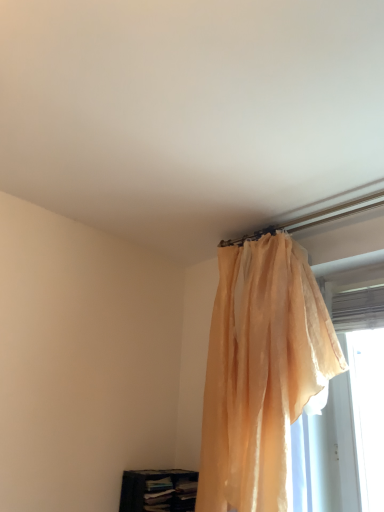
Question: From the image's perspective, is translucent peach curtain at upper right located beneath translucent fabric at right?

Choices:
 (A) yes
 (B) no

Answer: (A)

Question: Does translucent peach curtain at upper right come behind translucent fabric at right?

Choices:
 (A) yes
 (B) no

Answer: (B)

Question: From a real-world perspective, does translucent peach curtain at upper right stand above translucent fabric at right?

Choices:
 (A) no
 (B) yes

Answer: (A)

Question: Is translucent peach curtain at upper right facing away from translucent fabric at right?

Choices:
 (A) yes
 (B) no

Answer: (B)

Question: Is translucent peach curtain at upper right thinner than translucent fabric at right?

Choices:
 (A) yes
 (B) no

Answer: (B)

Question: Considering their positions, is translucent fabric at right located in front of or behind translucent peach curtain at upper right?

Choices:
 (A) behind
 (B) front

Answer: (A)

Question: Is translucent fabric at right situated inside translucent peach curtain at upper right or outside?

Choices:
 (A) outside
 (B) inside

Answer: (A)

Question: From a real-world perspective, relative to translucent peach curtain at upper right, is translucent fabric at right vertically above or below?

Choices:
 (A) below
 (B) above

Answer: (B)

Question: Is translucent fabric at right taller or shorter than translucent peach curtain at upper right?

Choices:
 (A) tall
 (B) short

Answer: (B)

Question: In terms of size, does dark blue fabric bookshelf at lower left appear bigger or smaller than translucent peach curtain at upper right?

Choices:
 (A) big
 (B) small

Answer: (B)

Question: Which is correct: dark blue fabric bookshelf at lower left is inside translucent peach curtain at upper right, or outside of it?

Choices:
 (A) inside
 (B) outside

Answer: (B)

Question: Is point (148, 486) positioned closer to the camera than point (241, 428)?

Choices:
 (A) closer
 (B) farther

Answer: (B)

Question: Looking at their shapes, would you say dark blue fabric bookshelf at lower left is wider or thinner than translucent peach curtain at upper right?

Choices:
 (A) wide
 (B) thin

Answer: (A)

Question: Based on their positions, is translucent peach curtain at upper right located to the left or right of dark blue fabric bookshelf at lower left?

Choices:
 (A) left
 (B) right

Answer: (B)

Question: Is translucent peach curtain at upper right taller or shorter than dark blue fabric bookshelf at lower left?

Choices:
 (A) short
 (B) tall

Answer: (B)